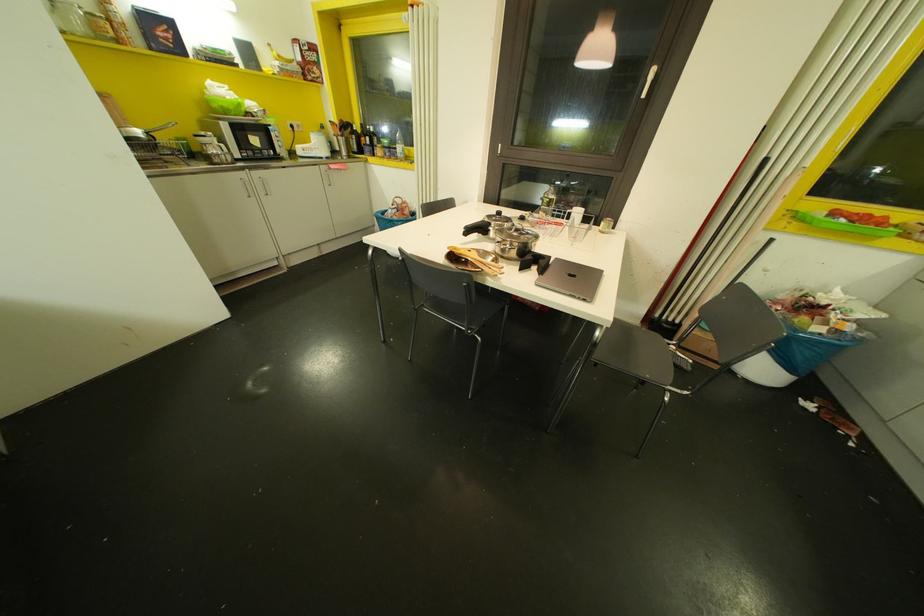
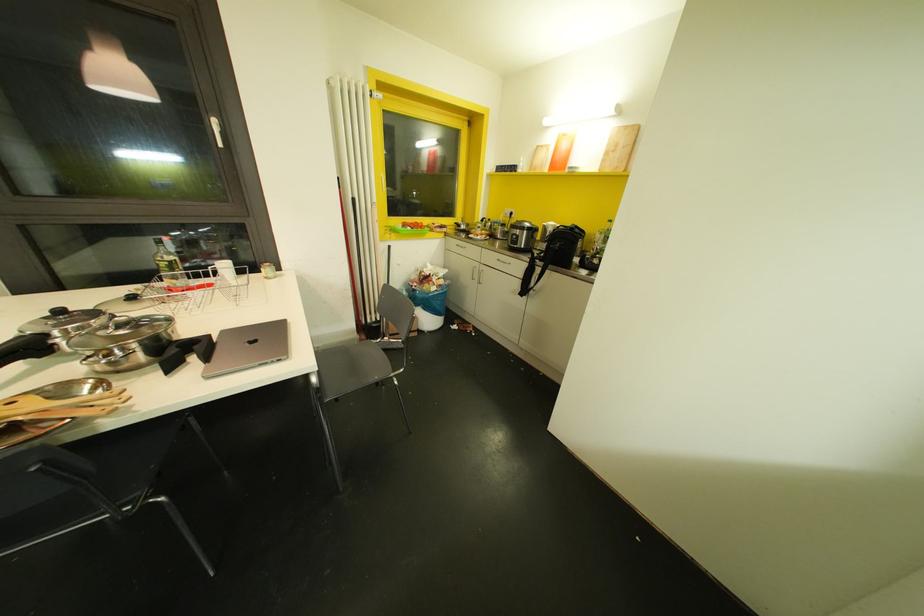
The point at (555,259) is marked in the first image. Where is the corresponding point in the second image?

(223, 331)